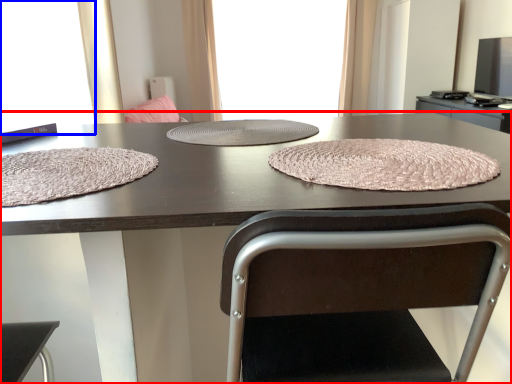
Question: Which object appears closest to the camera in this image, table (highlighted by a red box) or window screen (highlighted by a blue box)?

Choices:
 (A) table
 (B) window screen

Answer: (A)